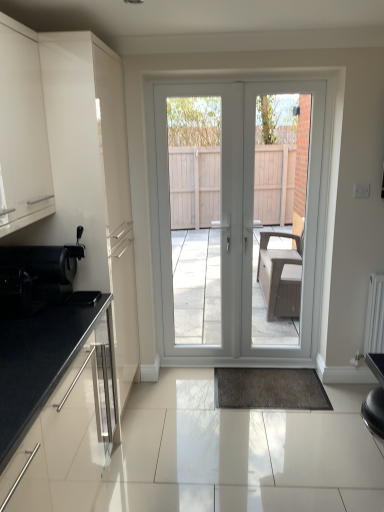
Image resolution: width=384 pixels, height=512 pixels. What do you see at coordinates (201, 228) in the screenshot?
I see `white glossy door at center, the first screen door viewed from the left` at bounding box center [201, 228].

This screenshot has height=512, width=384. In order to click on white plastic door at center, arranged as the second screen door when viewed from the left in this screenshot , I will do `click(286, 260)`.

Identify the location of white glossy door at center. The width and height of the screenshot is (384, 512). (235, 226).

Find the location of a particular element. Image resolution: width=384 pixels, height=512 pixels. shiny black coffee machine at left is located at coordinates (34, 278).

Based on the photo, from a real-world perspective, is matte white cabinet at left, the second cabinetry from the bottom, positioned above or below black granite countertop at lower left, positioned as the second cabinetry in top-to-bottom order?

Clearly, from a real-world perspective, matte white cabinet at left, the second cabinetry from the bottom, is above black granite countertop at lower left, positioned as the second cabinetry in top-to-bottom order.

Considering the relative sizes of matte white cabinet at left, the second cabinetry from the bottom, and black granite countertop at lower left, arranged as the first cabinetry when ordered from the bottom, in the image provided, is matte white cabinet at left, the second cabinetry from the bottom, smaller than black granite countertop at lower left, arranged as the first cabinetry when ordered from the bottom,?

Actually, matte white cabinet at left, the second cabinetry from the bottom, might be larger than black granite countertop at lower left, arranged as the first cabinetry when ordered from the bottom.

This screenshot has height=512, width=384. What are the coordinates of `cabinetry in front of the black granite countertop at lower left, arranged as the first cabinetry when ordered from the bottom` in the screenshot? It's located at (22, 131).

Who is taller, matte white cabinet at left, which is the first cabinetry in top-to-bottom order, or black granite countertop at lower left, arranged as the first cabinetry when ordered from the bottom?

Standing taller between the two is matte white cabinet at left, which is the first cabinetry in top-to-bottom order.

Is point (53, 273) more distant than point (230, 216)?

No, (53, 273) is closer to viewer.

Is shiny black coffee machine at left aimed at white glossy door at center, the first screen door viewed from the left?

No, shiny black coffee machine at left is not facing towards white glossy door at center, the first screen door viewed from the left.

From a real-world perspective, is shiny black coffee machine at left beneath white glossy door at center, which ranks as the 2th screen door in right-to-left order?

Yes, from a real-world perspective, shiny black coffee machine at left is under white glossy door at center, which ranks as the 2th screen door in right-to-left order.

Consider the image. Is white plastic door at center, the 1th screen door viewed from the right, bigger than black granite countertop at lower left, positioned as the second cabinetry in top-to-bottom order?

Yes, white plastic door at center, the 1th screen door viewed from the right, is bigger than black granite countertop at lower left, positioned as the second cabinetry in top-to-bottom order.

In the scene shown: Which of these two, white plastic door at center, the 1th screen door viewed from the right, or black granite countertop at lower left, positioned as the second cabinetry in top-to-bottom order, stands taller?

white plastic door at center, the 1th screen door viewed from the right.

Where is `screen door that is the 1st object located behind the black granite countertop at lower left, positioned as the second cabinetry in top-to-bottom order`? Image resolution: width=384 pixels, height=512 pixels. screen door that is the 1st object located behind the black granite countertop at lower left, positioned as the second cabinetry in top-to-bottom order is located at coordinates (286, 260).

Based on their positions, is white plastic door at center, the 1th screen door viewed from the right, located to the left or right of white glossy door at center?

In the image, white plastic door at center, the 1th screen door viewed from the right, appears on the right side of white glossy door at center.

Based on their sizes in the image, would you say white plastic door at center, the 1th screen door viewed from the right, is bigger or smaller than white glossy door at center?

Clearly, white plastic door at center, the 1th screen door viewed from the right, is larger in size than white glossy door at center.

Based on the photo, can you tell me how much white plastic door at center, arranged as the second screen door when viewed from the left, and white glossy door at center differ in facing direction?

The angular difference between white plastic door at center, arranged as the second screen door when viewed from the left, and white glossy door at center is 0.2 degrees.

Does matte white cabinet at left, the second cabinetry from the bottom, lie behind white glossy door at center?

No.

Which point is more forward, (32, 169) or (168, 110)?

The point (32, 169) is closer to the camera.

Looking at this image, could you tell me if matte white cabinet at left, which is the first cabinetry in top-to-bottom order, is facing white glossy door at center?

No.

Which is behind, point (163, 247) or point (206, 189)?

The point (163, 247) is farther from the camera.

Considering the positions of objects white glossy door at center, the first screen door viewed from the left, and white glossy door at center in the image provided, who is more to the right, white glossy door at center, the first screen door viewed from the left, or white glossy door at center?

white glossy door at center.

From the image's perspective, is white glossy door at center, the first screen door viewed from the left, located above white glossy door at center?

Correct, white glossy door at center, the first screen door viewed from the left, appears higher than white glossy door at center in the image.

Can you confirm if matte white cabinet at left, which is the first cabinetry in top-to-bottom order, is smaller than white glossy door at center, which ranks as the 2th screen door in right-to-left order?

Correct, matte white cabinet at left, which is the first cabinetry in top-to-bottom order, occupies less space than white glossy door at center, which ranks as the 2th screen door in right-to-left order.

Which of these two, matte white cabinet at left, the second cabinetry from the bottom, or white glossy door at center, the first screen door viewed from the left, stands shorter?

matte white cabinet at left, the second cabinetry from the bottom.

Which object is positioned more to the left, matte white cabinet at left, which is the first cabinetry in top-to-bottom order, or white glossy door at center, the first screen door viewed from the left?

matte white cabinet at left, which is the first cabinetry in top-to-bottom order.

Looking at this image, can you see matte white cabinet at left, the second cabinetry from the bottom, touching white glossy door at center, the first screen door viewed from the left?

There is a gap between matte white cabinet at left, the second cabinetry from the bottom, and white glossy door at center, the first screen door viewed from the left.

In the image, there is a black granite countertop at lower left, arranged as the first cabinetry when ordered from the bottom. Where is `cabinetry above it (from the image's perspective)`? The image size is (384, 512). cabinetry above it (from the image's perspective) is located at coordinates (22, 131).

From the shiny black coffee machine at left, count 2nd screen doors backward and point to it. Please provide its 2D coordinates.

[(201, 228)]

From the image, which object appears to be farther from matte white cabinet at left, the second cabinetry from the bottom, black granite countertop at lower left, arranged as the first cabinetry when ordered from the bottom, or white glossy door at center?

white glossy door at center is further to matte white cabinet at left, the second cabinetry from the bottom.

Looking at this image, which object lies nearer to the anchor point black granite countertop at lower left, arranged as the first cabinetry when ordered from the bottom, white plastic door at center, arranged as the second screen door when viewed from the left, or shiny black coffee machine at left?

Based on the image, shiny black coffee machine at left appears to be nearer to black granite countertop at lower left, arranged as the first cabinetry when ordered from the bottom.

Based on the photo, when comparing their distances from matte white cabinet at left, which is the first cabinetry in top-to-bottom order, does white plastic door at center, the 1th screen door viewed from the right, or white glossy door at center, the first screen door viewed from the left, seem further?

white plastic door at center, the 1th screen door viewed from the right, is further to matte white cabinet at left, which is the first cabinetry in top-to-bottom order.

Considering their positions, is white plastic door at center, the 1th screen door viewed from the right, positioned closer to black granite countertop at lower left, arranged as the first cabinetry when ordered from the bottom, than white glossy door at center?

The object closer to black granite countertop at lower left, arranged as the first cabinetry when ordered from the bottom, is white glossy door at center.

Which object lies further to the anchor point white glossy door at center, matte white cabinet at left, the second cabinetry from the bottom, or white plastic door at center, arranged as the second screen door when viewed from the left?

matte white cabinet at left, the second cabinetry from the bottom, is positioned further to the anchor white glossy door at center.

Estimate the real-world distances between objects in this image. Which object is closer to white plastic door at center, arranged as the second screen door when viewed from the left, black granite countertop at lower left, positioned as the second cabinetry in top-to-bottom order, or matte white cabinet at left, which is the first cabinetry in top-to-bottom order?

The object closer to white plastic door at center, arranged as the second screen door when viewed from the left, is matte white cabinet at left, which is the first cabinetry in top-to-bottom order.

Which object lies nearer to the anchor point white glossy door at center, which ranks as the 2th screen door in right-to-left order, black granite countertop at lower left, arranged as the first cabinetry when ordered from the bottom, or matte white cabinet at left, which is the first cabinetry in top-to-bottom order?

matte white cabinet at left, which is the first cabinetry in top-to-bottom order, is positioned closer to the anchor white glossy door at center, which ranks as the 2th screen door in right-to-left order.

Considering their positions, is black granite countertop at lower left, arranged as the first cabinetry when ordered from the bottom, positioned closer to white glossy door at center than matte white cabinet at left, the second cabinetry from the bottom?

Among the two, matte white cabinet at left, the second cabinetry from the bottom, is located nearer to white glossy door at center.

What are the coordinates of `door between shiny black coffee machine at left and white plastic door at center, the 1th screen door viewed from the right` in the screenshot? It's located at (235, 226).

Where is `door located between white glossy door at center, the first screen door viewed from the left, and white plastic door at center, the 1th screen door viewed from the right, in the left-right direction`? This screenshot has width=384, height=512. door located between white glossy door at center, the first screen door viewed from the left, and white plastic door at center, the 1th screen door viewed from the right, in the left-right direction is located at coordinates (235, 226).

You are a GUI agent. You are given a task and a screenshot of the screen. Output one action in this format:
    pyautogui.click(x=<x>, y=<y>)
    Task: Click on the screen door between shiny black coffee machine at left and white plastic door at center, the 1th screen door viewed from the right
    
    Given the screenshot: What is the action you would take?
    pyautogui.click(x=201, y=228)

The height and width of the screenshot is (512, 384). In order to click on cabinetry located between shiny black coffee machine at left and white glossy door at center, which ranks as the 2th screen door in right-to-left order, in the depth direction in this screenshot , I will do `click(53, 369)`.